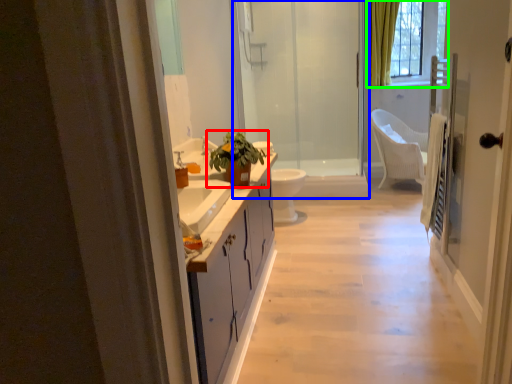
Question: Which is nearer to the houseplant (highlighted by a red box)? shower door (highlighted by a blue box) or window (highlighted by a green box).

Choices:
 (A) shower door
 (B) window

Answer: (A)